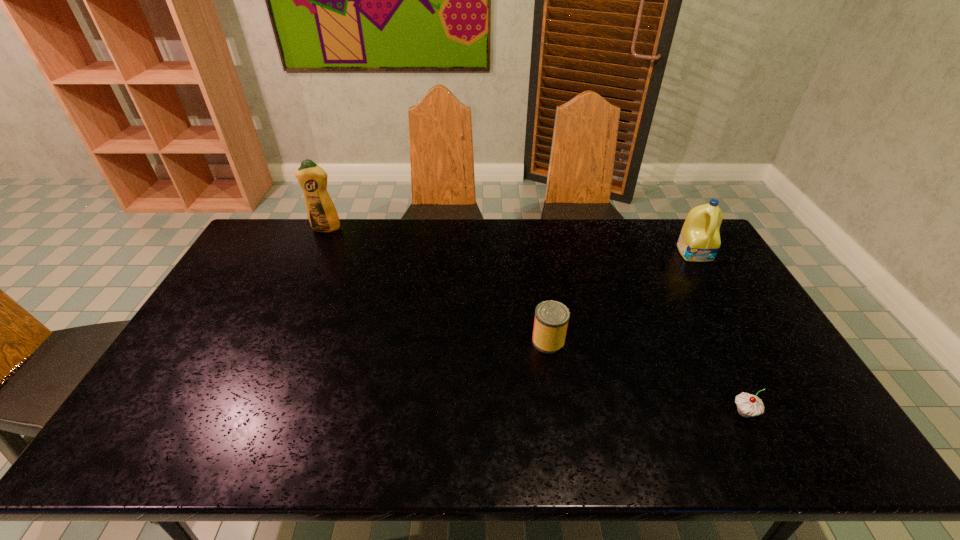
At what (x,y) coordinates should I click in order to perform the action: click on the taller detergent. Please return your answer as a coordinate pair (x, y). Looking at the image, I should click on coord(322,214).

The height and width of the screenshot is (540, 960). I want to click on the farthest object, so click(x=322, y=214).

The height and width of the screenshot is (540, 960). Find the location of `the shorter detergent`. the shorter detergent is located at coordinates (699, 241).

You are a GUI agent. You are given a task and a screenshot of the screen. Output one action in this format:
    pyautogui.click(x=<x>, y=<y>)
    Task: Click on the rightmost object
    
    Given the screenshot: What is the action you would take?
    pyautogui.click(x=699, y=241)

Find the location of a particular element. the second nearest object is located at coordinates (551, 319).

Locate an element on the screen. This screenshot has height=540, width=960. the third tallest object is located at coordinates (551, 319).

Where is `the nearest object`? The width and height of the screenshot is (960, 540). the nearest object is located at coordinates (748, 405).

This screenshot has width=960, height=540. Find the location of `cupcake`. cupcake is located at coordinates (748, 405).

I want to click on vacant area situated 0.100m on the label of the taller detergent, so click(x=316, y=249).

You are a GUI agent. You are given a task and a screenshot of the screen. Output one action in this format:
    pyautogui.click(x=<x>, y=<y>)
    Task: Click on the free space located on the label of the shorter detergent
    The image size is (960, 540).
    Given the screenshot: What is the action you would take?
    pyautogui.click(x=732, y=315)